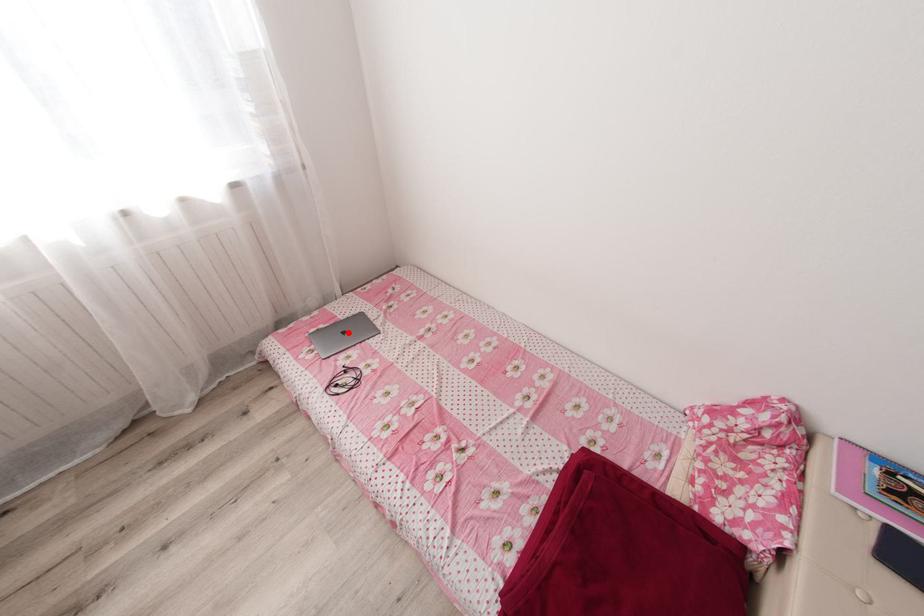
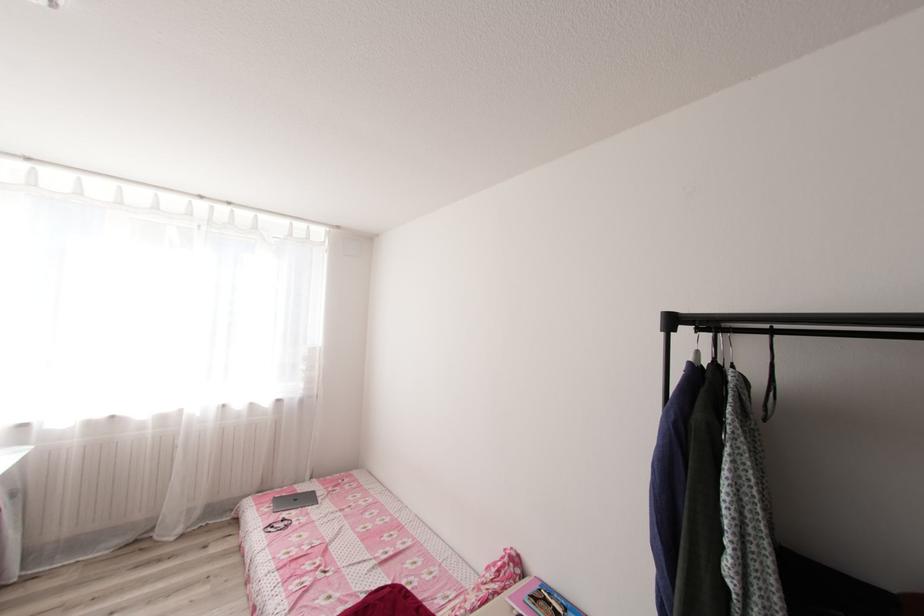
Find the pixel in the second image that matches the highlighted location in the first image.

(300, 499)